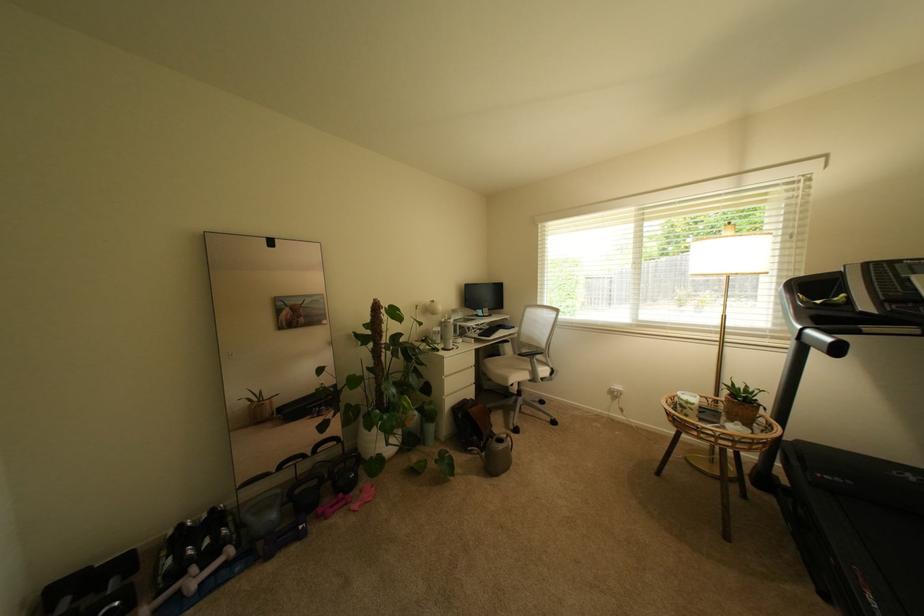
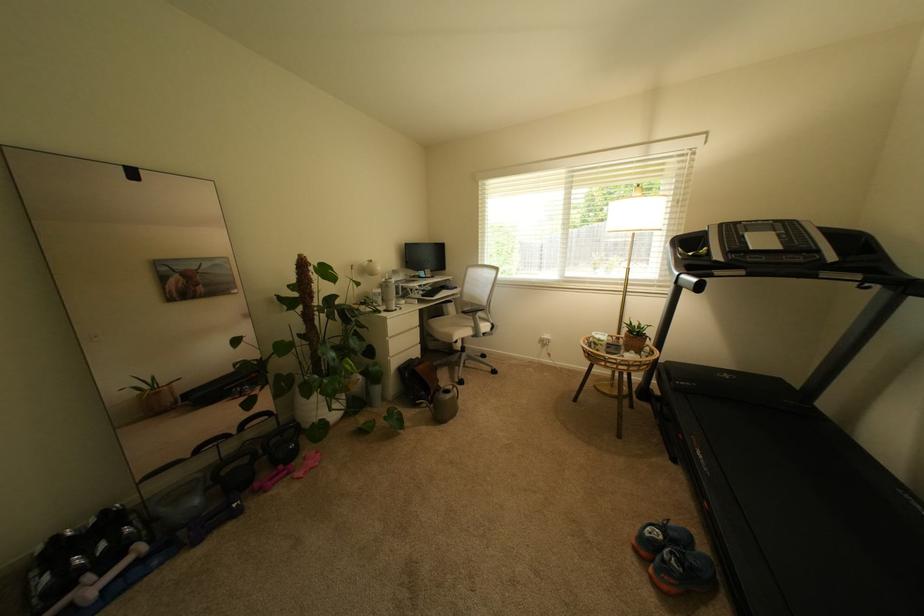
The images are taken continuously from a first-person perspective. In which direction are you moving?

The cameraman moved toward left, forward.